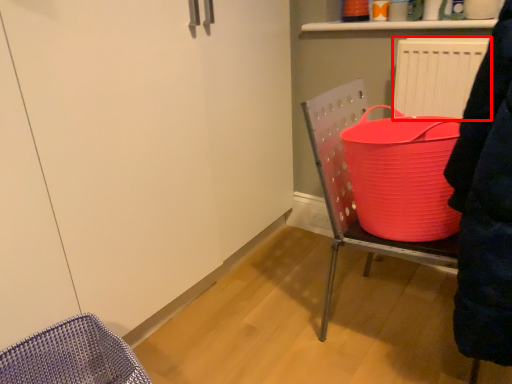
Question: From the image's perspective, what is the correct spatial relationship of radiator (annotated by the red box) in relation to furniture?

Choices:
 (A) below
 (B) above

Answer: (B)